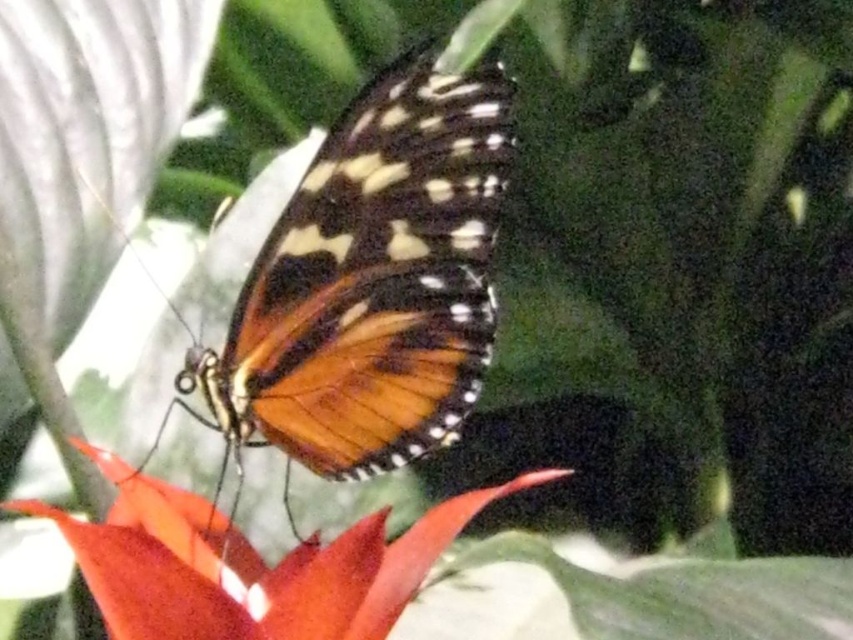
Question: Which point is closer to the camera?

Choices:
 (A) (445, 172)
 (B) (297, 602)

Answer: (B)

Question: Is orange iridescent wings at center wider than orange matte flower at center?

Choices:
 (A) no
 (B) yes

Answer: (A)

Question: Considering the relative positions of orange iridescent wings at center and orange matte flower at center in the image provided, where is orange iridescent wings at center located with respect to orange matte flower at center?

Choices:
 (A) above
 (B) below

Answer: (A)

Question: Which object appears closest to the camera in this image?

Choices:
 (A) orange matte flower at center
 (B) orange iridescent wings at center

Answer: (A)

Question: Can you confirm if orange iridescent wings at center is thinner than orange matte flower at center?

Choices:
 (A) yes
 (B) no

Answer: (A)